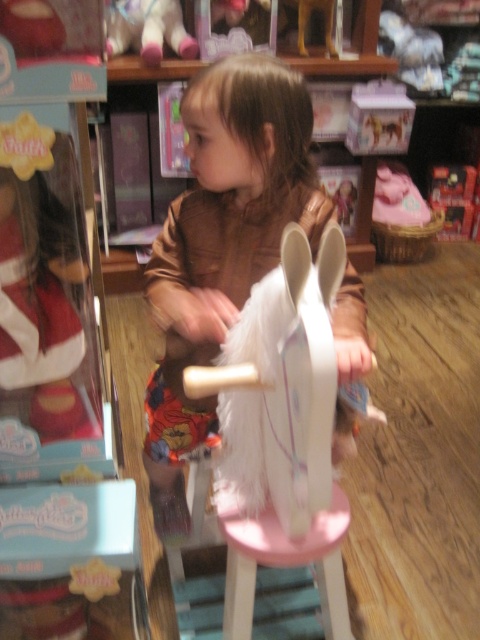
The child is wearing a brown plush jacket at center and sitting on a pink wood stool at center. Which item is closer to the viewer?

A: The brown plush jacket at center is closer to the viewer than the pink wood stool at center.

You are a photographer taking a picture of the toy store scene. You notice two points in the image at coordinates point (211,397) and point (113,54). Which point will appear larger in the photo?

Point (211,397) is closer to the camera than point (113,54), so it will appear larger in the photo.

You are a customer in the store. You see a point at coordinate (x=222, y=246). What object does this point correspond to?

The point at coordinate (x=222, y=246) corresponds to the brown plush jacket at center.